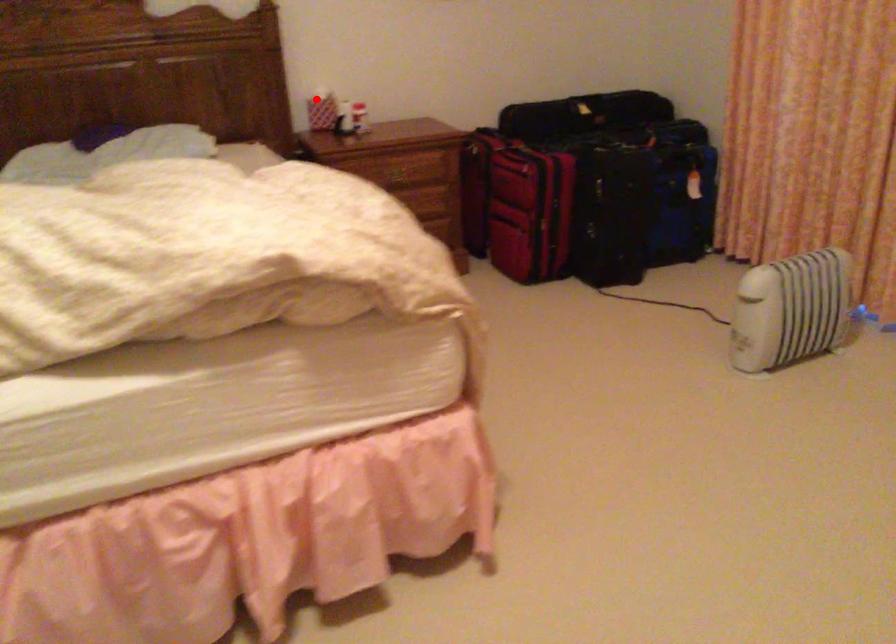
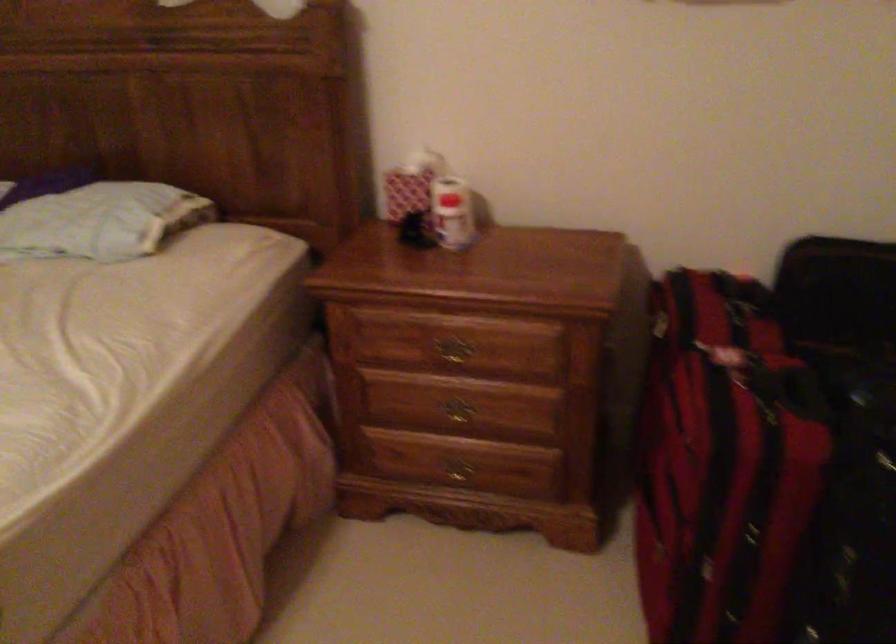
Question: I am providing you with two images of the same scene from different viewpoints. A red point is shown in image1. For the corresponding object point in image2, is it positioned nearer or farther from the camera?

Choices:
 (A) Nearer
 (B) Farther

Answer: (A)